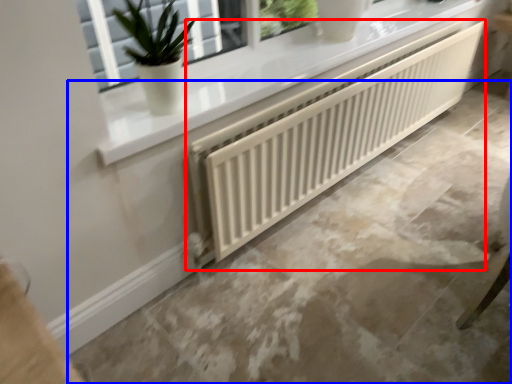
Question: Which point is closer to the camera, radiator (highlighted by a red box) or concrete (highlighted by a blue box)?

Choices:
 (A) radiator
 (B) concrete

Answer: (B)